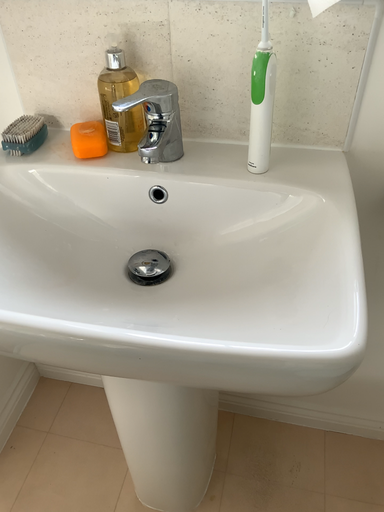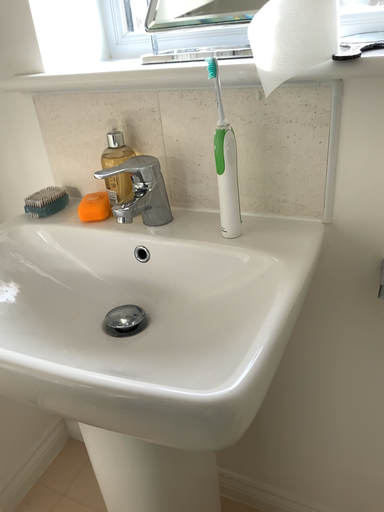
Question: Which way did the camera rotate in the video?

Choices:
 (A) rotated right
 (B) rotated left

Answer: (B)